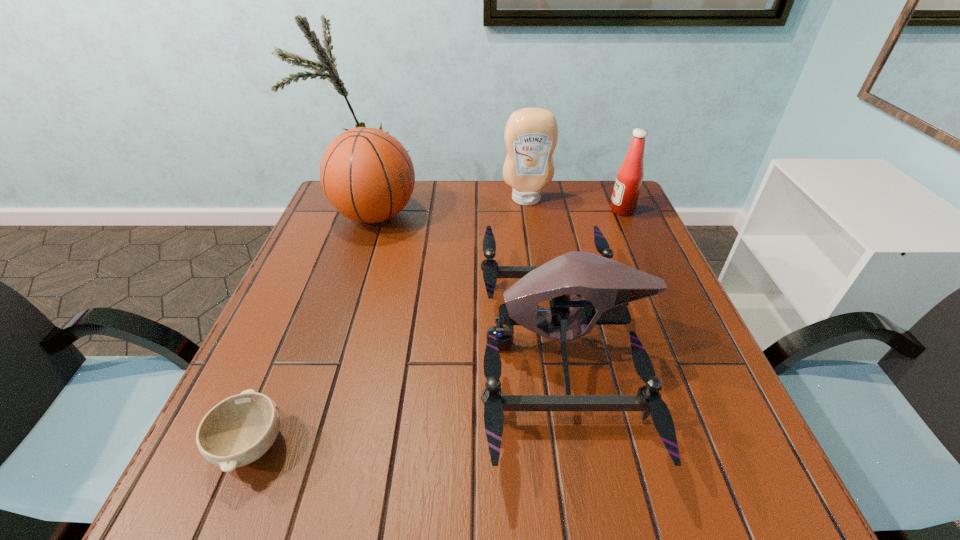
Identify the location of the left condiment. The height and width of the screenshot is (540, 960). (531, 134).

I want to click on basketball, so click(x=368, y=176).

Identify the location of the rightmost object. The image size is (960, 540). (629, 178).

Locate an element on the screen. This screenshot has height=540, width=960. drone is located at coordinates (608, 286).

Find the location of a particular element. This screenshot has width=960, height=540. the shortest object is located at coordinates (237, 431).

Locate an element on the screen. This screenshot has width=960, height=540. free space located 0.180m on the label of the left condiment is located at coordinates (533, 245).

Image resolution: width=960 pixels, height=540 pixels. In order to click on vacant region located 0.180m on the front of the basketball in this screenshot , I will do `click(352, 288)`.

At what (x,y) coordinates should I click in order to perform the action: click on free location located 0.240m on the front-facing side of the rightmost object. Please return your answer as a coordinate pair (x, y). Image resolution: width=960 pixels, height=540 pixels. Looking at the image, I should click on (525, 211).

What are the coordinates of `vacant area situated on the front-facing side of the rightmost object` in the screenshot? It's located at (540, 211).

I want to click on free region located on the front-facing side of the rightmost object, so click(550, 211).